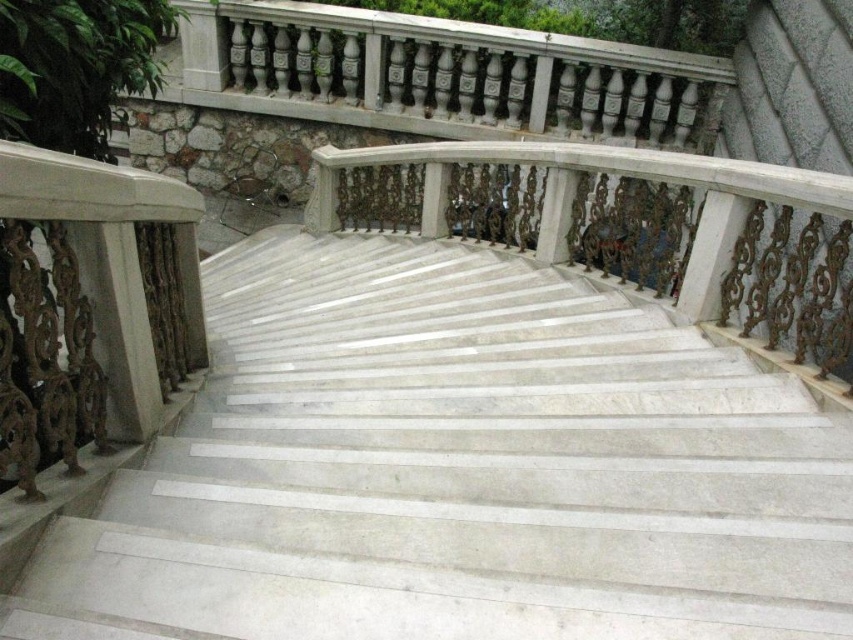
You are a maintenance worker needing to clean the white marble stairs at center and the white marble balustrade at center. You have a 1.5 meter long mop. Can you reach the balustrade from the stairs without moving the mop?

The white marble stairs at center is 1.26 meters away from the white marble balustrade at center. Since the mop is 1.5 meters long, you can extend it to reach the balustrade from the stairs without needing to move the mop.

In the scene shown: You are standing at the bottom of the grand staircase and want to walk up the steps. Which object should you step on first, the white marble stairs at center or the white marble balustrade at center?

You should step on the white marble stairs at center first because they are positioned to the left of the white marble balustrade at center, making them the actual steps you would climb.

You are standing at the bottom of the white marble stairs at center. You want to reach the top floor. How many steps do you need to climb?

The white marble stairs at center is 4.79 feet away from camera. The number of steps required to reach the top floor cannot be determined from the given information.